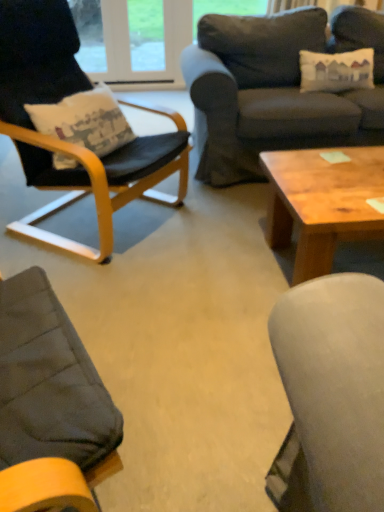
Question: From a real-world perspective, relative to dark gray fabric couch at upper right, is black leather chair at left vertically above or below?

Choices:
 (A) above
 (B) below

Answer: (A)

Question: From the image's perspective, is black leather chair at left positioned above or below dark gray fabric couch at upper right?

Choices:
 (A) below
 (B) above

Answer: (A)

Question: Which is nearer to the black leather chair at left?

Choices:
 (A) wooden coffee table at center
 (B) dark gray fabric couch at upper right

Answer: (A)

Question: Which object is positioned closest to the black leather chair at left?

Choices:
 (A) dark gray fabric couch at upper right
 (B) wooden coffee table at center

Answer: (B)